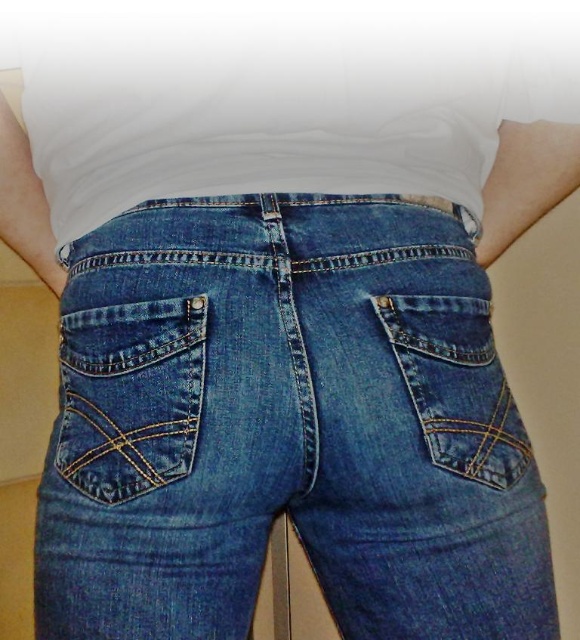
Question: Which object is farther from the camera taking this photo?

Choices:
 (A) denim pocket at lower left
 (B) white matte shirt at center
 (C) denim blue jeans at center
 (D) denim pocket at center-right

Answer: (B)

Question: Is denim blue jeans at center to the right of denim pocket at lower left from the viewer's perspective?

Choices:
 (A) no
 (B) yes

Answer: (B)

Question: Can you confirm if denim blue jeans at center is positioned below denim pocket at center-right?

Choices:
 (A) no
 (B) yes

Answer: (B)

Question: Among these points, which one is farthest from the camera?

Choices:
 (A) (409, 369)
 (B) (68, 314)
 (C) (304, 403)

Answer: (B)

Question: Does white matte shirt at center have a larger size compared to denim pocket at lower left?

Choices:
 (A) yes
 (B) no

Answer: (A)

Question: Estimate the real-world distances between objects in this image. Which object is closer to the denim blue jeans at center?

Choices:
 (A) white matte shirt at center
 (B) denim pocket at lower left
 (C) denim pocket at center-right

Answer: (B)